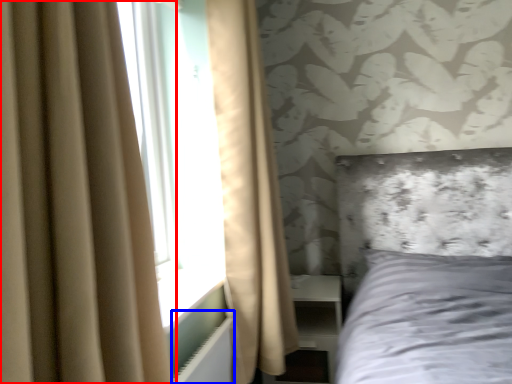
Question: Which of the following is the farthest to the observer, curtain (highlighted by a red box) or radiator (highlighted by a blue box)?

Choices:
 (A) curtain
 (B) radiator

Answer: (B)